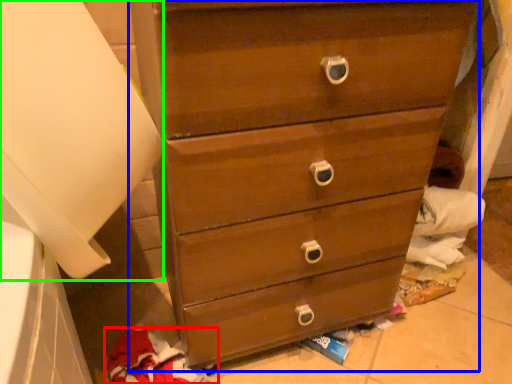
Question: Estimate the real-world distances between objects in this image. Which object is farther from clothing (highlighted by a red box), chest of drawers (highlighted by a blue box) or paper towel (highlighted by a green box)?

Choices:
 (A) chest of drawers
 (B) paper towel

Answer: (B)